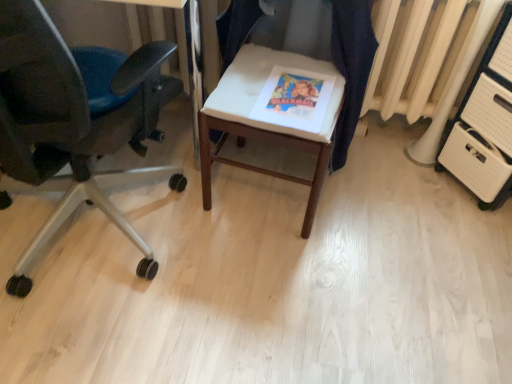
Question: From the image's perspective, is matte paper magazine at center located above white fabric cushion at center, the first chair from the right?

Choices:
 (A) no
 (B) yes

Answer: (A)

Question: Are matte paper magazine at center and white fabric cushion at center, the first chair from the right, making contact?

Choices:
 (A) no
 (B) yes

Answer: (A)

Question: From a real-world perspective, does matte paper magazine at center stand above white fabric cushion at center, which appears as the 2th chair when viewed from the left?

Choices:
 (A) yes
 (B) no

Answer: (A)

Question: Considering the relative sizes of matte paper magazine at center and white fabric cushion at center, which appears as the 2th chair when viewed from the left, in the image provided, is matte paper magazine at center wider than white fabric cushion at center, which appears as the 2th chair when viewed from the left,?

Choices:
 (A) no
 (B) yes

Answer: (B)

Question: Can you confirm if matte paper magazine at center is shorter than white fabric cushion at center, the first chair from the right?

Choices:
 (A) no
 (B) yes

Answer: (B)

Question: Considering their positions, is white fabric chair at center located in front of or behind matte paper magazine at center?

Choices:
 (A) front
 (B) behind

Answer: (A)

Question: Is white fabric chair at center to the left or to the right of matte paper magazine at center in the image?

Choices:
 (A) right
 (B) left

Answer: (B)

Question: From the image's perspective, is white fabric chair at center above or below matte paper magazine at center?

Choices:
 (A) below
 (B) above

Answer: (B)

Question: Considering the positions of white fabric chair at center and matte paper magazine at center in the image, is white fabric chair at center wider or thinner than matte paper magazine at center?

Choices:
 (A) wide
 (B) thin

Answer: (A)

Question: From a real-world perspective, relative to white fabric chair at center, is white fabric cushion at center, which appears as the 2th chair when viewed from the left, vertically above or below?

Choices:
 (A) below
 (B) above

Answer: (B)

Question: Relative to white fabric chair at center, is white fabric cushion at center, the first chair from the right, in front or behind?

Choices:
 (A) behind
 (B) front

Answer: (A)

Question: In terms of size, does white fabric cushion at center, the first chair from the right, appear bigger or smaller than white fabric chair at center?

Choices:
 (A) big
 (B) small

Answer: (B)

Question: Considering the positions of white fabric cushion at center, which appears as the 2th chair when viewed from the left, and white fabric chair at center in the image, is white fabric cushion at center, which appears as the 2th chair when viewed from the left, taller or shorter than white fabric chair at center?

Choices:
 (A) tall
 (B) short

Answer: (B)

Question: Considering the positions of point (317, 94) and point (247, 92), is point (317, 94) closer or farther from the camera than point (247, 92)?

Choices:
 (A) farther
 (B) closer

Answer: (A)

Question: In terms of width, does matte paper magazine at center look wider or thinner when compared to white fabric chair at center?

Choices:
 (A) wide
 (B) thin

Answer: (B)